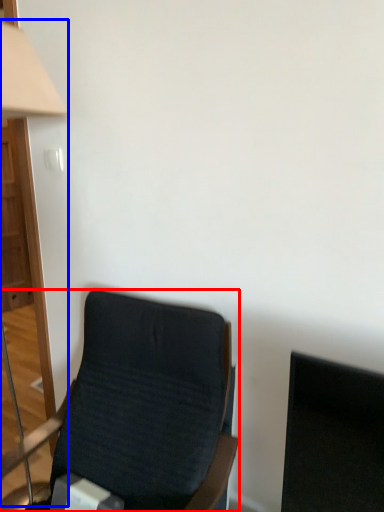
Question: Which object appears closest to the camera in this image, chair (highlighted by a red box) or table lamp (highlighted by a blue box)?

Choices:
 (A) chair
 (B) table lamp

Answer: (A)